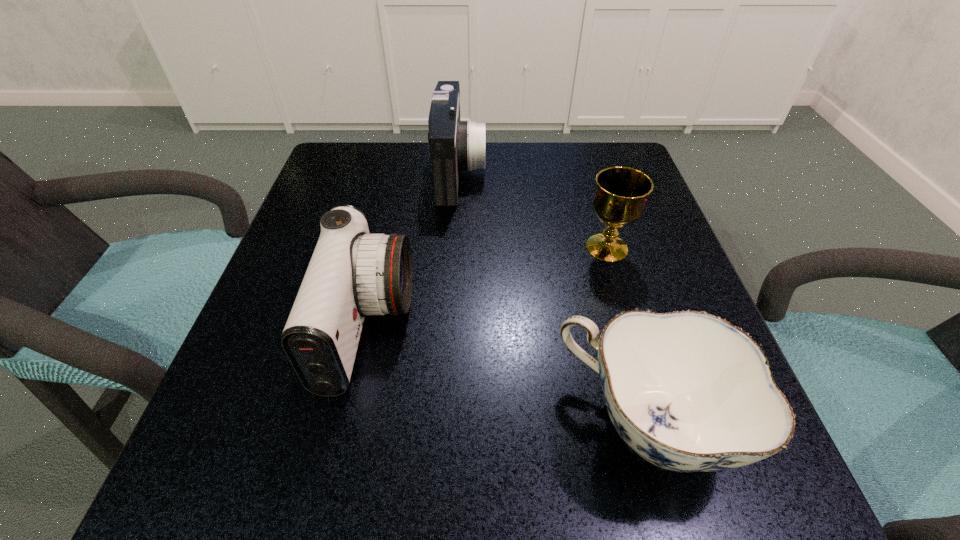
This screenshot has width=960, height=540. Identify the location of the second object from left to right. (455, 146).

Image resolution: width=960 pixels, height=540 pixels. Find the location of `the farthest object`. the farthest object is located at coordinates (455, 146).

Locate an element on the screen. the leftmost object is located at coordinates (352, 273).

Where is `the left camcorder`? This screenshot has height=540, width=960. the left camcorder is located at coordinates (352, 273).

Where is `chalice`? chalice is located at coordinates (621, 194).

This screenshot has width=960, height=540. I want to click on chinaware, so click(687, 391).

Find the location of a particular element. vacant space situated 0.260m on the lens of the right camcorder is located at coordinates (598, 171).

Identify the location of free region located 0.230m on the surface of the nearer camcorder. 553,328.

Find the location of a particular element. free space located 0.300m on the left of the second farthest object is located at coordinates (423, 247).

Find the location of a particular element. The height and width of the screenshot is (540, 960). free location located on the left of the chinaware is located at coordinates (523, 424).